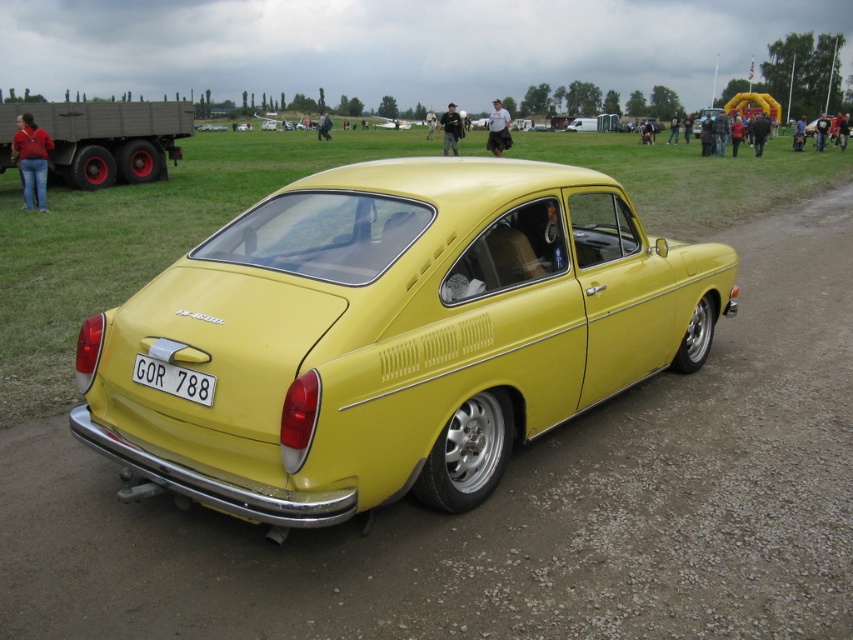
Who is positioned more to the right, yellow matte car at center or white plastic license plate at rear?

yellow matte car at center is more to the right.

Who is more distant from viewer, (x=527, y=189) or (x=183, y=396)?

The point (x=527, y=189) is more distant.

Identify the location of yellow matte car at center. The width and height of the screenshot is (853, 640). (393, 336).